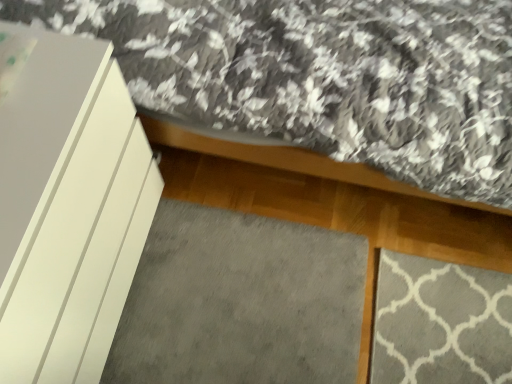
Question: Should I look upward or downward to see white matte cabinet at left?

Choices:
 (A) down
 (B) up

Answer: (A)

Question: Considering the relative positions of gray soft carpet at lower center and white matte cabinet at left in the image provided, is gray soft carpet at lower center to the left of white matte cabinet at left from the viewer's perspective?

Choices:
 (A) yes
 (B) no

Answer: (B)

Question: From a real-world perspective, does gray soft carpet at lower center stand above white matte cabinet at left?

Choices:
 (A) yes
 (B) no

Answer: (B)

Question: Is gray soft carpet at lower center further to the viewer compared to white matte cabinet at left?

Choices:
 (A) no
 (B) yes

Answer: (B)

Question: Does gray soft carpet at lower center come in front of white matte cabinet at left?

Choices:
 (A) yes
 (B) no

Answer: (B)

Question: Does gray soft carpet at lower center turn towards white matte cabinet at left?

Choices:
 (A) no
 (B) yes

Answer: (A)

Question: Can you confirm if gray soft carpet at lower center is wider than white matte cabinet at left?

Choices:
 (A) no
 (B) yes

Answer: (B)

Question: Are white matte cabinet at left and gray soft carpet at lower center located far from each other?

Choices:
 (A) no
 (B) yes

Answer: (A)

Question: Is white matte cabinet at left outside of gray soft carpet at lower center?

Choices:
 (A) yes
 (B) no

Answer: (A)

Question: Considering the relative positions of white matte cabinet at left and gray soft carpet at lower center in the image provided, is white matte cabinet at left to the right of gray soft carpet at lower center from the viewer's perspective?

Choices:
 (A) no
 (B) yes

Answer: (A)

Question: Can you confirm if white matte cabinet at left is thinner than gray soft carpet at lower center?

Choices:
 (A) yes
 (B) no

Answer: (A)

Question: Considering the relative positions of white matte cabinet at left and gray soft carpet at lower center in the image provided, is white matte cabinet at left to the left of gray soft carpet at lower center from the viewer's perspective?

Choices:
 (A) yes
 (B) no

Answer: (A)

Question: Is white matte cabinet at left taller than gray soft carpet at lower center?

Choices:
 (A) no
 (B) yes

Answer: (B)

Question: From a real-world perspective, is gray soft carpet at lower center physically located above or below white matte cabinet at left?

Choices:
 (A) below
 (B) above

Answer: (A)